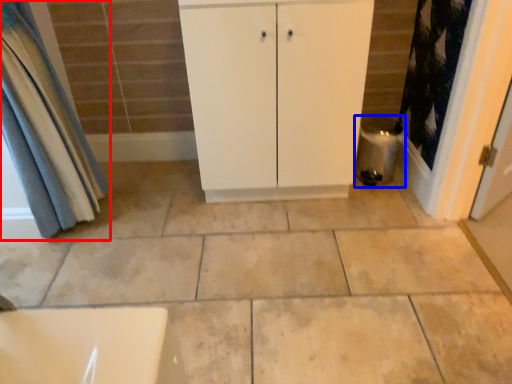
Question: Among these objects, which one is farthest to the camera, curtain (highlighted by a red box) or water heater (highlighted by a blue box)?

Choices:
 (A) curtain
 (B) water heater

Answer: (B)